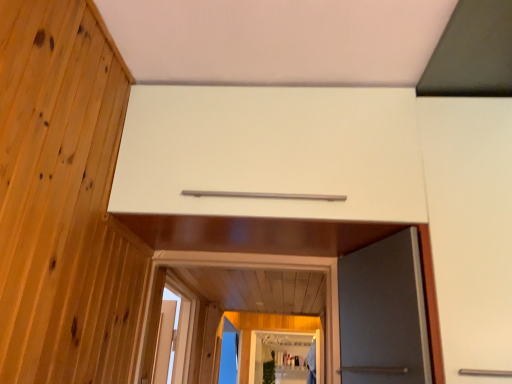
Measure the distance between white matte panel at center and camera.

white matte panel at center is 4.06 feet away from camera.

What is the approximate height of white matte panel at center?

18.62 inches.

The height and width of the screenshot is (384, 512). I want to click on white matte panel at center, so click(271, 152).

What do you see at coordinates (271, 152) in the screenshot? This screenshot has height=384, width=512. I see `white matte panel at center` at bounding box center [271, 152].

This screenshot has height=384, width=512. Find the location of `white matte panel at center`. white matte panel at center is located at coordinates (271, 152).